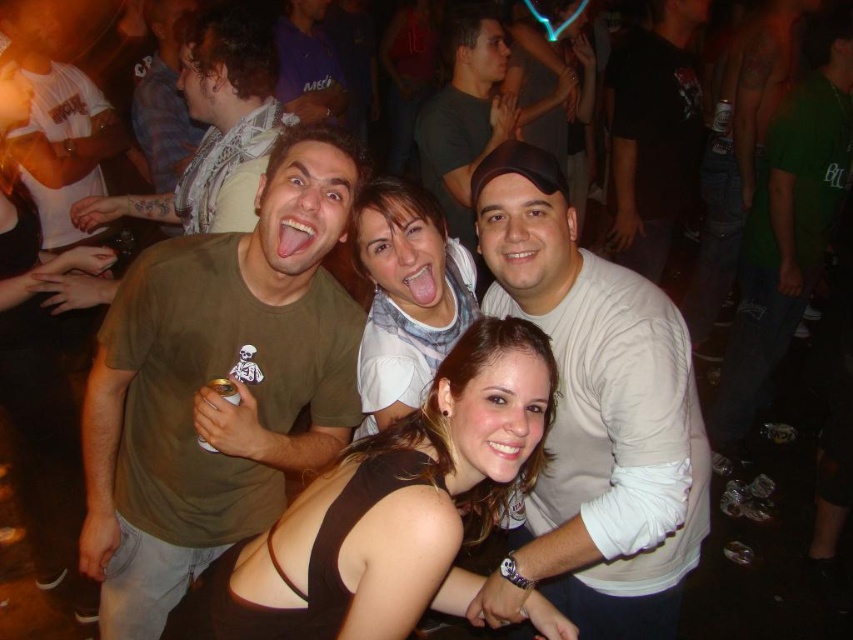
You are a photographer trying to adjust the lighting for a group photo. You need to ensure that the white matte shirt at center is well lit. Where should you position the light source relative to the camera?

The white matte shirt at center is positioned at point 0.653 on the horizontal axis and 0.696 on the vertical axis. To ensure proper lighting, the light source should be placed directly in front of the camera, aligned with these coordinates to illuminate the white matte shirt at center effectively.